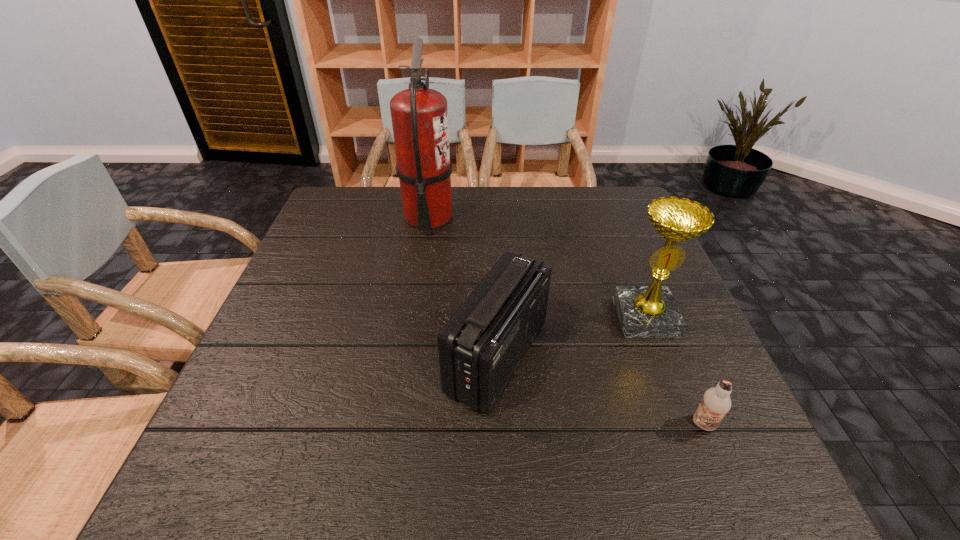
The width and height of the screenshot is (960, 540). Identify the location of the farthest object. (419, 115).

Locate an element on the screen. The width and height of the screenshot is (960, 540). fire extinguisher is located at coordinates (419, 115).

In order to click on award in this screenshot , I will do `click(651, 311)`.

I want to click on the second shortest object, so coord(481,346).

At what (x,y) coordinates should I click in order to perform the action: click on the second object from left to right. Please return your answer as a coordinate pair (x, y). This screenshot has width=960, height=540. Looking at the image, I should click on (481, 346).

At what (x,y) coordinates should I click in order to perform the action: click on chocolate milk. Please return your answer as a coordinate pair (x, y). Looking at the image, I should click on (716, 403).

Locate an element on the screen. The image size is (960, 540). free region located 0.270m toward the nozzle of the farthest object is located at coordinates (544, 217).

Locate an element on the screen. The height and width of the screenshot is (540, 960). vacant position located 0.050m on the front-facing side of the award is located at coordinates (660, 356).

The image size is (960, 540). In order to click on free location located on the front panel of the second object from left to right in this screenshot , I will do `click(417, 357)`.

You are a GUI agent. You are given a task and a screenshot of the screen. Output one action in this format:
    pyautogui.click(x=<x>, y=<y>)
    Task: Click on the vacant space located 0.110m on the front panel of the second object from left to right
    This screenshot has height=540, width=960.
    Given the screenshot: What is the action you would take?
    pyautogui.click(x=393, y=357)